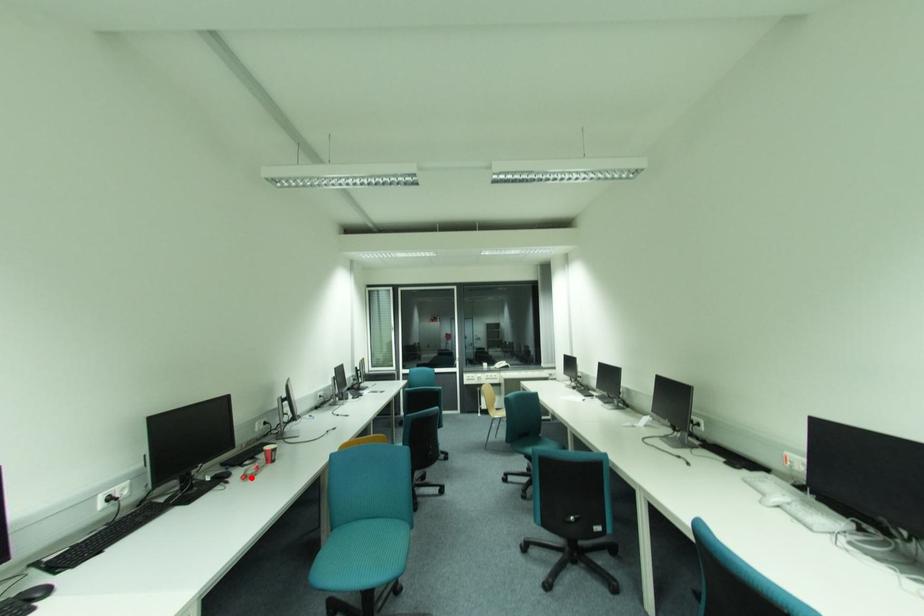
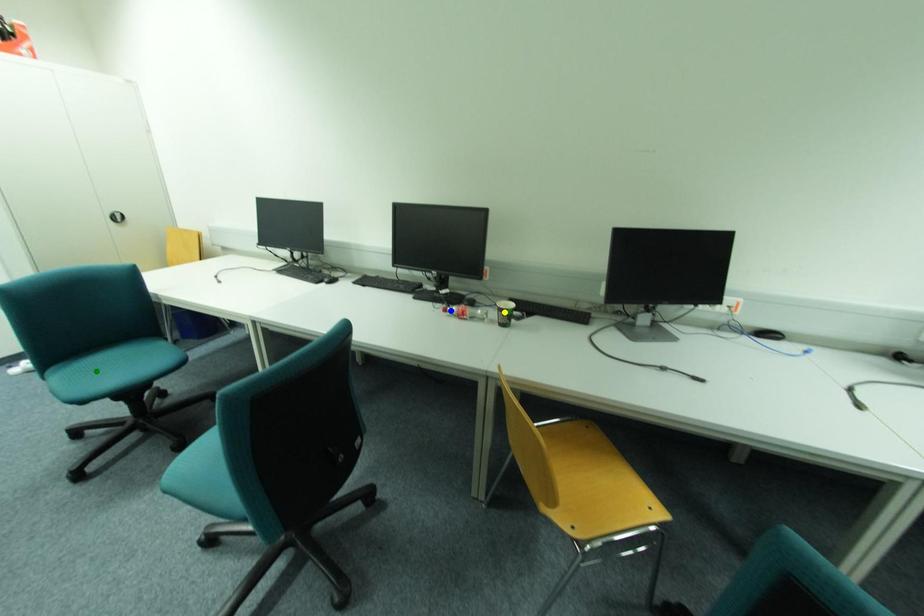
Question: I am providing you with two images of the same scene from different viewpoints. A red point is marked on the first image. You are given multiple points on the second image. Which spot in image 2 lines up with the point in image 1?

Choices:
 (A) blue point
 (B) green point
 (C) yellow point

Answer: (A)